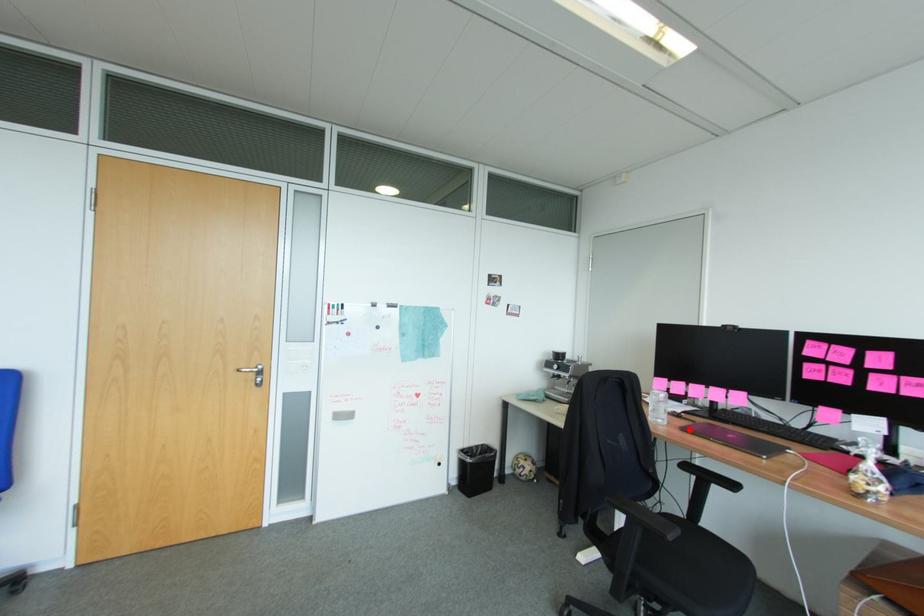
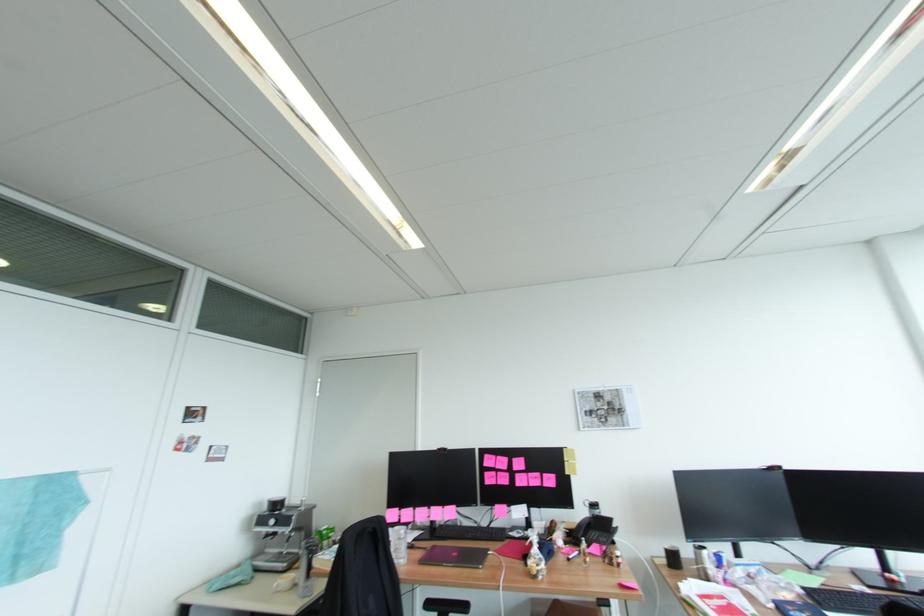
Locate, in the second image, the point that corresponds to the highlighted location in the first image.

(428, 562)